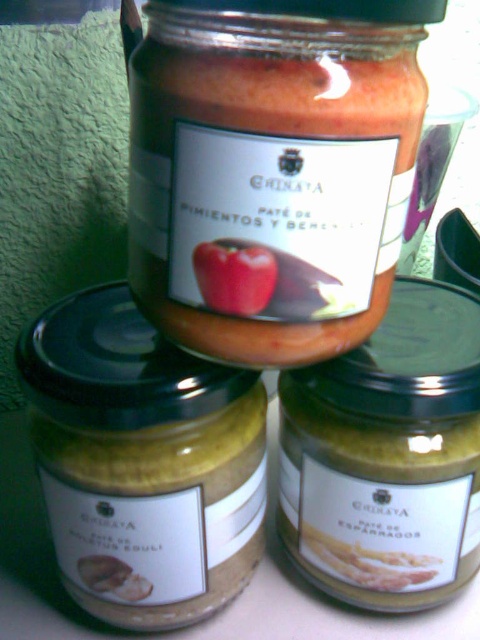
Question: Observing the image, what is the correct spatial positioning of matte glass jar at center in reference to matte yellow spread at lower left?

Choices:
 (A) right
 (B) left

Answer: (A)

Question: Which point is farther to the camera?

Choices:
 (A) green matte jar of pâté de espárragos at center
 (B) matte yellow spread at lower left

Answer: (A)

Question: Can you confirm if green matte jar of pâté de espárragos at center is positioned to the right of red matte apple at center?

Choices:
 (A) yes
 (B) no

Answer: (A)

Question: Can you confirm if matte glass jar at center is bigger than red matte apple at center?

Choices:
 (A) yes
 (B) no

Answer: (A)

Question: Which object is positioned farthest from the matte glass jar at center?

Choices:
 (A) red matte apple at center
 (B) green matte jar of pâté de espárragos at center

Answer: (B)

Question: Which point is closer to the camera?

Choices:
 (A) red matte apple at center
 (B) green matte jar of pâté de espárragos at center
 (C) matte glass jar at center

Answer: (C)